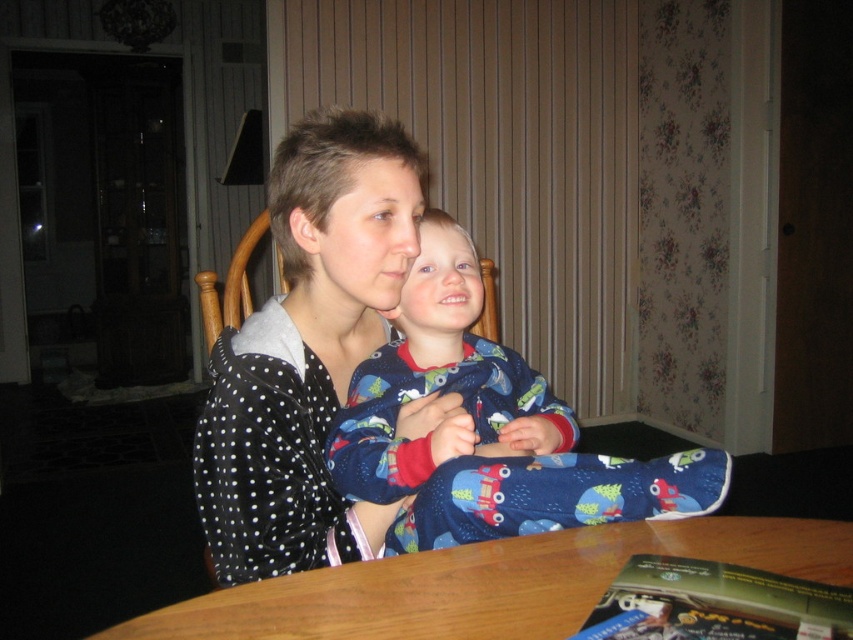
Question: Which point is closer to the camera taking this photo?

Choices:
 (A) (346, 492)
 (B) (215, 484)

Answer: (B)

Question: Does polka dot fabric at center lie in front of wooden table at center?

Choices:
 (A) yes
 (B) no

Answer: (B)

Question: Which point appears closest to the camera in this image?

Choices:
 (A) (351, 413)
 (B) (396, 163)

Answer: (B)

Question: Which of the following is the closest to the observer?

Choices:
 (A) (440, 554)
 (B) (409, 305)

Answer: (A)

Question: Can you confirm if polka dot fabric at center is smaller than blue cotton pajamas at center?

Choices:
 (A) yes
 (B) no

Answer: (B)

Question: Is polka dot fabric at center to the right of blue cotton pajamas at center from the viewer's perspective?

Choices:
 (A) no
 (B) yes

Answer: (A)